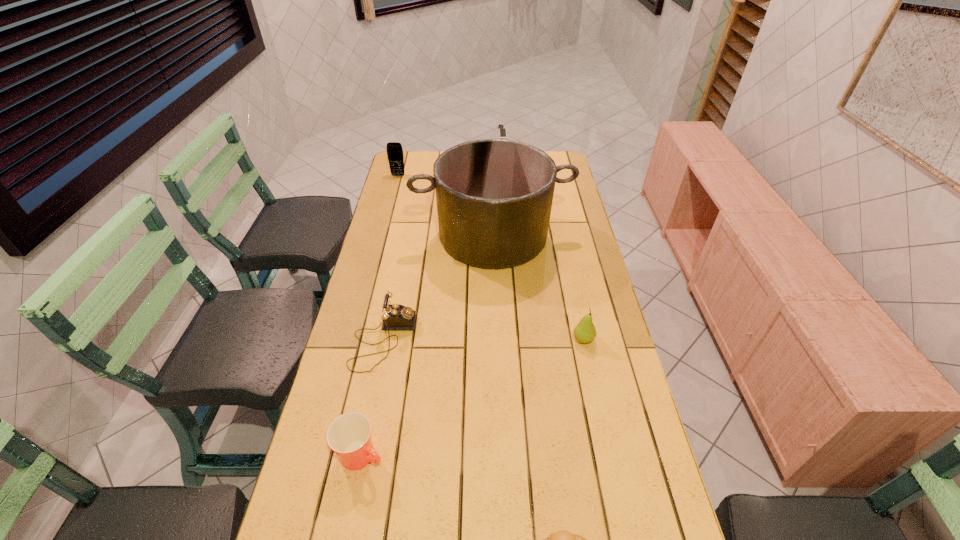
This screenshot has width=960, height=540. What are the coordinates of `vacant point located between the cellular telephone and the second nearest object` in the screenshot? It's located at (380, 315).

Point out which object is positioned as the sixth nearest to the duckling. Please provide its 2D coordinates. Your answer should be formatted as a tuple, i.e. [(x, y)], where the tuple contains the x and y coordinates of a point satisfying the conditions above.

[(395, 156)]

Identify which object is the fourth closest to the telephone. Please provide its 2D coordinates. Your answer should be formatted as a tuple, i.e. [(x, y)], where the tuple contains the x and y coordinates of a point satisfying the conditions above.

[(563, 539)]

In order to click on free spot that satisfies the following two spatial constraints: 1. on the screen of the cellular telephone; 2. on the right side of the third farthest object in this screenshot , I will do `click(382, 235)`.

At what (x,y) coordinates should I click in order to perform the action: click on vacant space that satisfies the following two spatial constraints: 1. on the recording direction of the camcorder; 2. on the right side of the pear. Please return your answer as a coordinate pair (x, y). The image size is (960, 540). Looking at the image, I should click on pyautogui.click(x=499, y=339).

Identify the location of vacant region that satisfies the following two spatial constraints: 1. on the recording direction of the camcorder; 2. on the dial of the telephone. (499, 340).

You are a GUI agent. You are given a task and a screenshot of the screen. Output one action in this format:
    pyautogui.click(x=<x>, y=<y>)
    Task: Click on the vacant space that satisfies the following two spatial constraints: 1. on the front side of the pan; 2. on the dial of the telephone
    Image resolution: width=960 pixels, height=540 pixels.
    Given the screenshot: What is the action you would take?
    tap(496, 340)